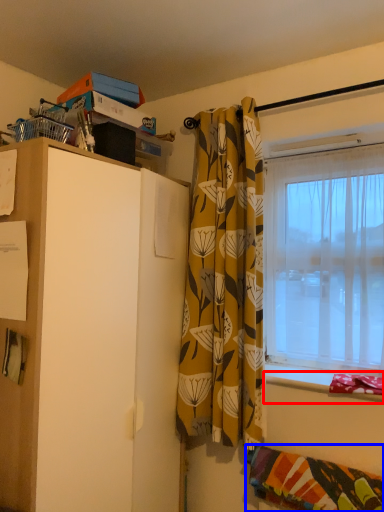
Question: Among these objects, which one is nearest to the camera, window sill (highlighted by a red box) or blanket (highlighted by a blue box)?

Choices:
 (A) window sill
 (B) blanket

Answer: (B)